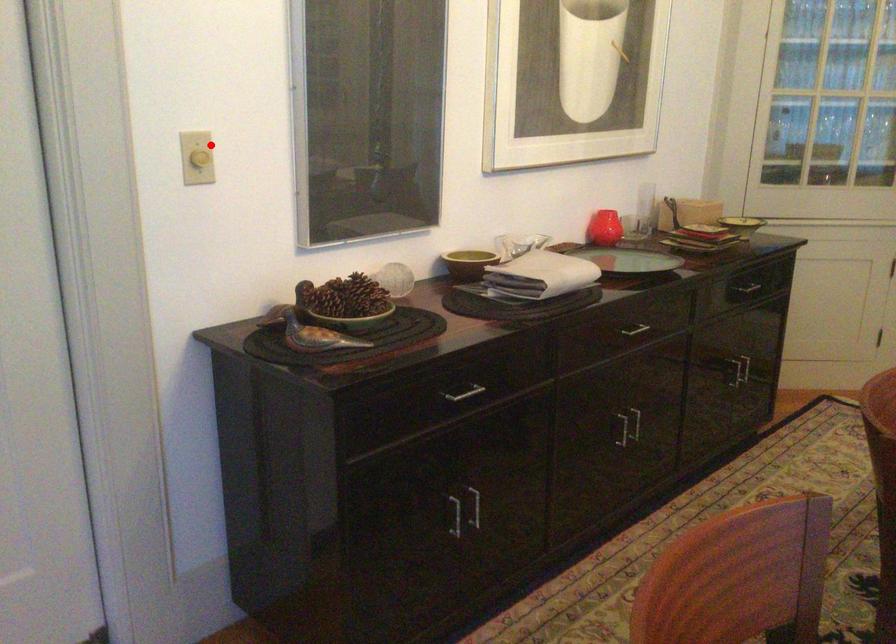
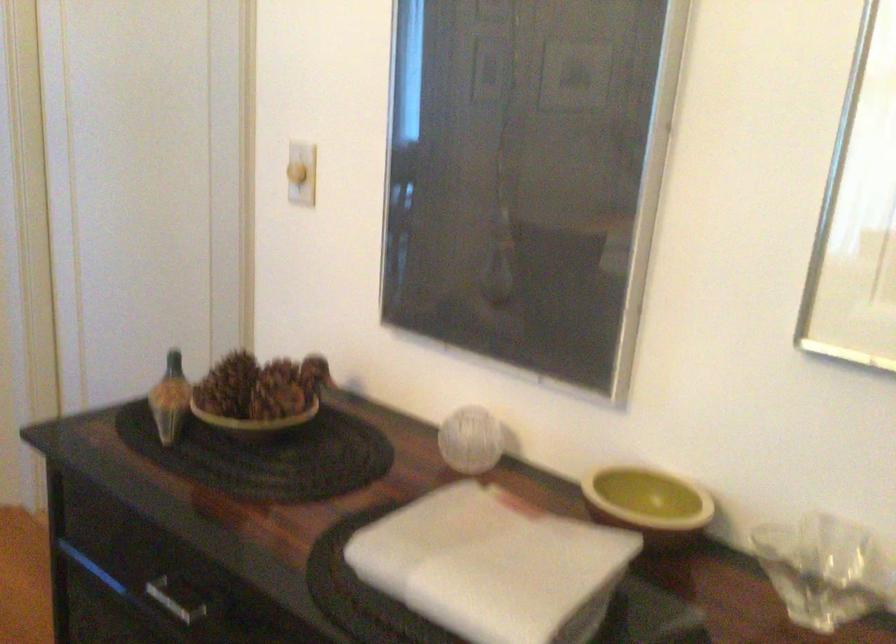
Find the pixel in the second image that matches the highlighted location in the first image.

(297, 173)